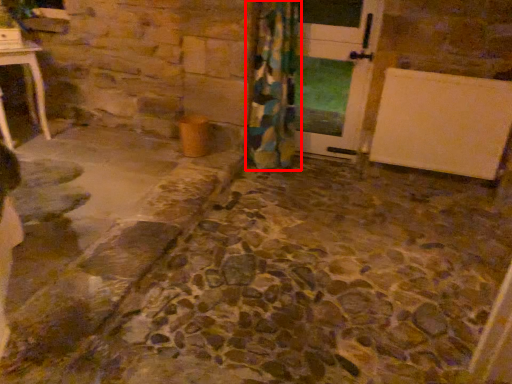
Question: From the image's perspective, what is the correct spatial relationship of curtain (annotated by the red box) in relation to door?

Choices:
 (A) below
 (B) above

Answer: (A)